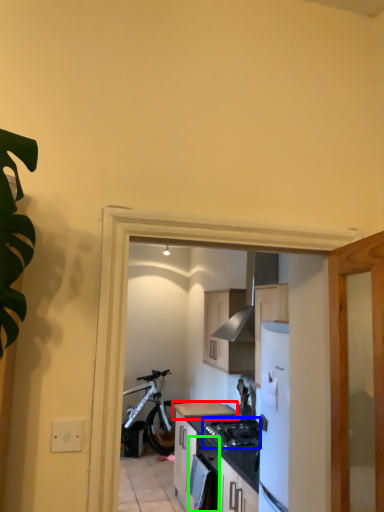
Question: Estimate the real-world distances between objects in this image. Which object is farther from countertop (highlighted by a red box), gas stove (highlighted by a blue box) or oven (highlighted by a green box)?

Choices:
 (A) gas stove
 (B) oven

Answer: (B)